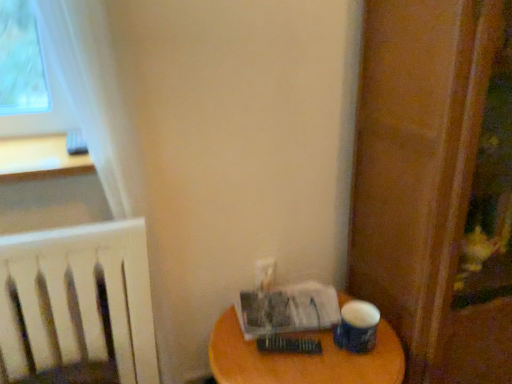
Find the location of a particular element. vacant space situated on the left part of hardcover book at center, marked as the first paperback book in a front-to-back arrangement is located at coordinates (242, 349).